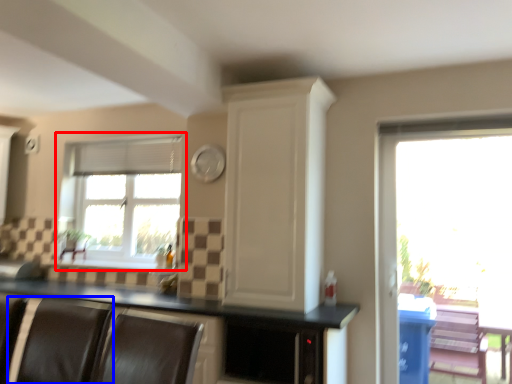
Question: Which of the following is the farthest to the observer, window (highlighted by a red box) or armchair (highlighted by a blue box)?

Choices:
 (A) window
 (B) armchair

Answer: (A)